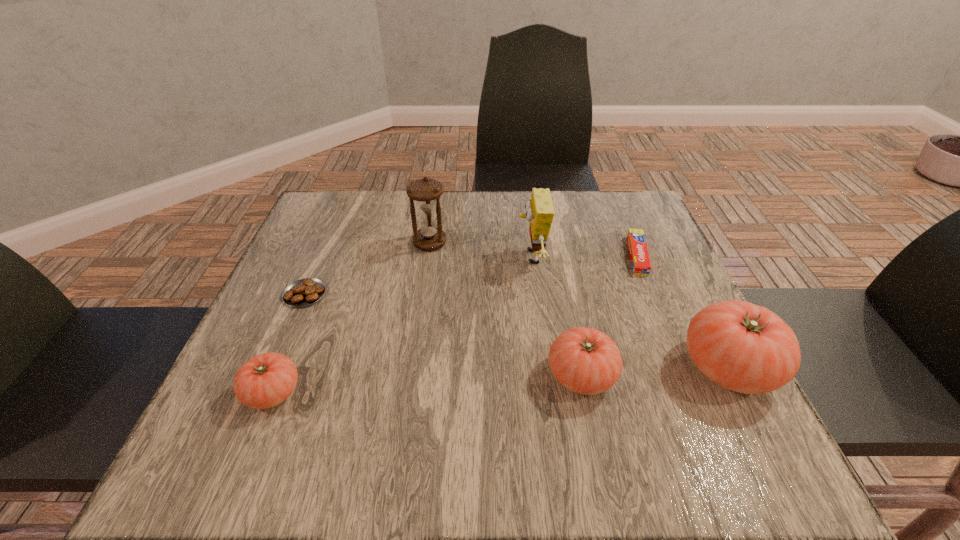
The width and height of the screenshot is (960, 540). Identify the location of sponge at the far edge. (540, 212).

Image resolution: width=960 pixels, height=540 pixels. I want to click on hourglass that is at the far edge, so click(x=426, y=192).

Identify the location of tomato located in the left edge section of the desktop. (266, 380).

Identify the location of pastry at the left edge. (303, 292).

Where is `tomato present at the right edge`? tomato present at the right edge is located at coordinates (743, 347).

Identify the location of toothpaste that is positioned at the right edge. (639, 256).

Locate an element on the screen. The height and width of the screenshot is (540, 960). object located at the near left corner is located at coordinates (266, 380).

Find the location of a particular element. This screenshot has width=960, height=540. object that is at the far right corner is located at coordinates (639, 256).

Identify the location of object that is at the near right corner. The height and width of the screenshot is (540, 960). (743, 347).

Image resolution: width=960 pixels, height=540 pixels. What are the coordinates of `vacant space at the far edge of the desktop` in the screenshot? It's located at (398, 236).